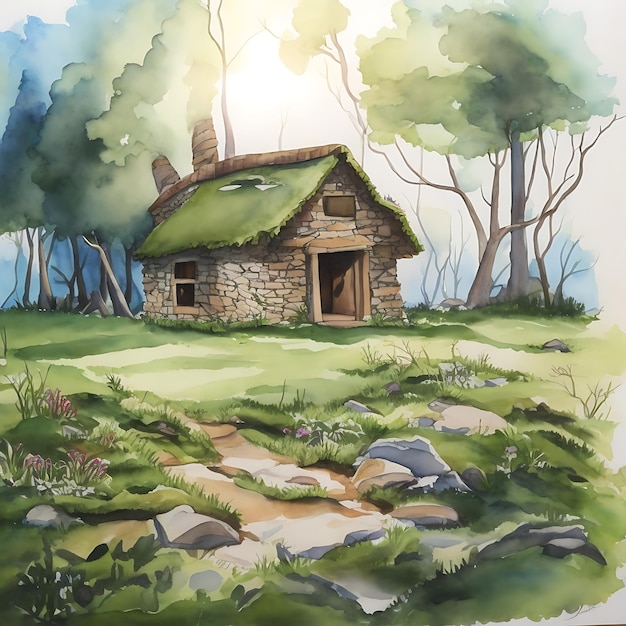
Identify the location of chimney. The image size is (626, 626). (203, 140).